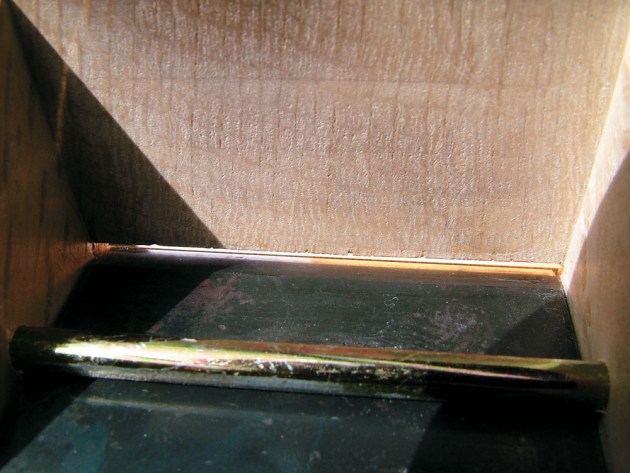
Locate an element on the screen. tan wood is located at coordinates (570, 163).